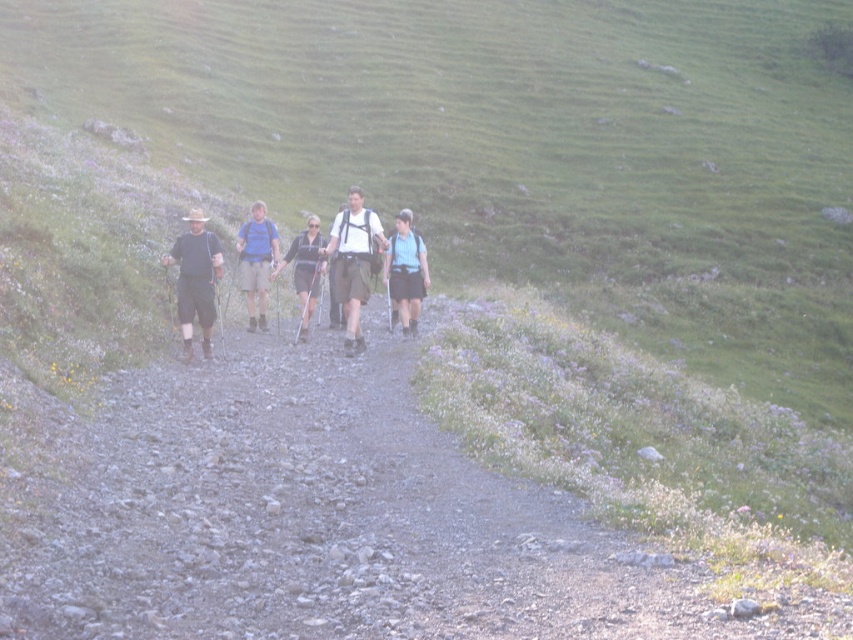
You are a hiker standing at the starting point of the trail. You notice two points marked on the map corresponding to coordinates point (202, 259) and point (397, 218). Which point should you head towards if you want to reach the one that is closer to your current position?

You should head towards point (202, 259) because it is closer to the camera, which represents your current position, compared to point (397, 218).

You are a hiker planning to carry both the white fabric backpack at center and the matte black jacket at center on your hike. Since you want to ensure they fit in your pack, can you determine which item has a smaller width?

The white fabric backpack at center has a smaller width than the matte black jacket at center according to the description provided.

You are one of the hikers on the rocky path. You notice two items at center in your view. Which item is positioned lower down between the white fabric backpack at center and the matte black jacket at center?

The white fabric backpack at center is positioned lower down than the matte black jacket at center.